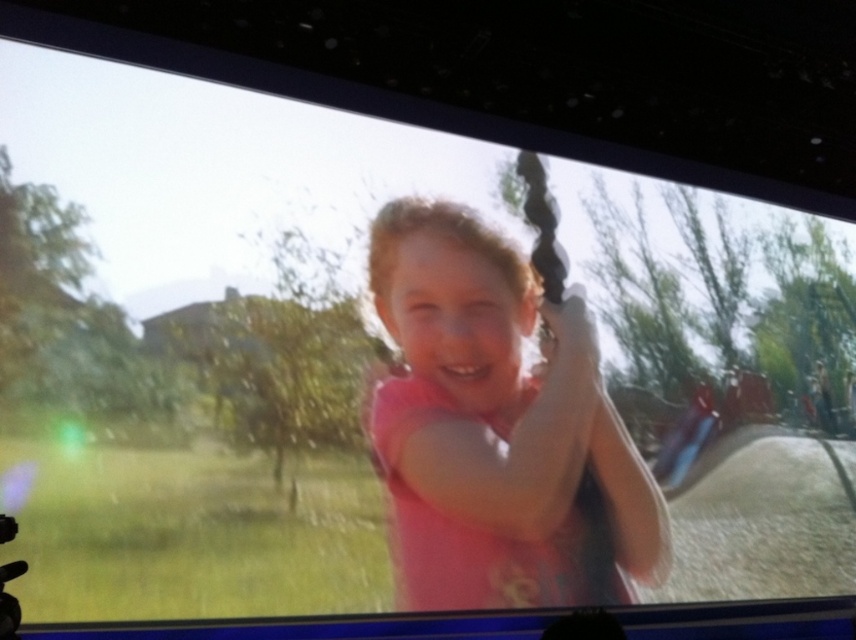
Is pink matte shirt at center positioned at the back of matte plastic bag at lower right?

No.

Between pink matte shirt at center and matte plastic bag at lower right, which one appears on the right side from the viewer's perspective?

matte plastic bag at lower right

Between point (456, 577) and point (690, 442), which one is positioned behind?

Positioned behind is point (690, 442).

The image size is (856, 640). Identify the location of pink matte shirt at center. (497, 429).